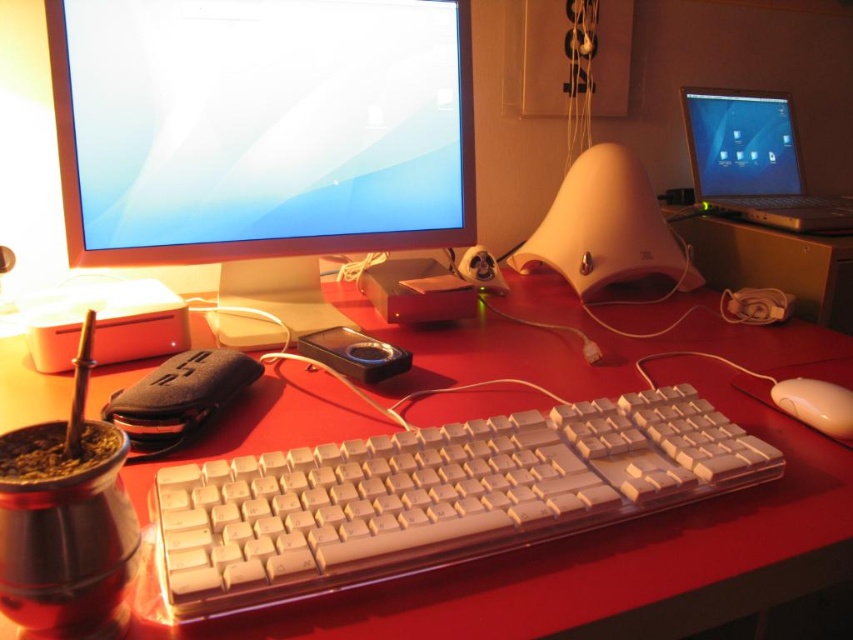
Question: Which of the following is the closest to the observer?

Choices:
 (A) metallic silver laptop at upper right
 (B) white plastic keyboard at center

Answer: (B)

Question: Is white plastic keyboard at center to the left of beige plastic mouse at lower right from the viewer's perspective?

Choices:
 (A) yes
 (B) no

Answer: (A)

Question: Which object is positioned closest to the white plastic keyboard at center?

Choices:
 (A) beige plastic mouse at lower right
 (B) white plastic monitor at upper left

Answer: (A)

Question: In this image, where is red plastic keyboard at center located relative to metallic silver laptop at upper right?

Choices:
 (A) right
 (B) left

Answer: (B)

Question: Among these points, which one is farthest from the camera?

Choices:
 (A) pyautogui.click(x=576, y=605)
 (B) pyautogui.click(x=183, y=472)

Answer: (B)

Question: Does red plastic keyboard at center have a greater width compared to metallic silver laptop at upper right?

Choices:
 (A) yes
 (B) no

Answer: (A)